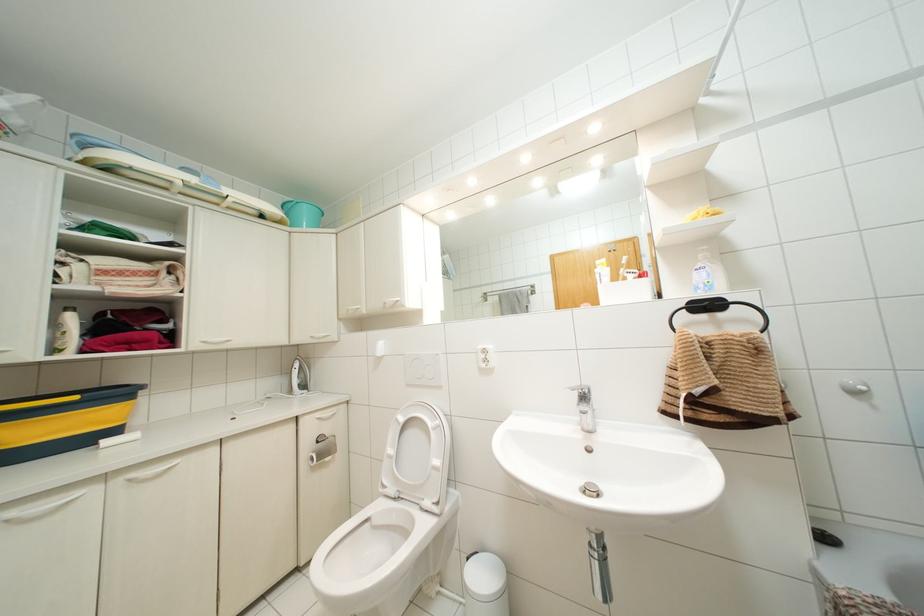
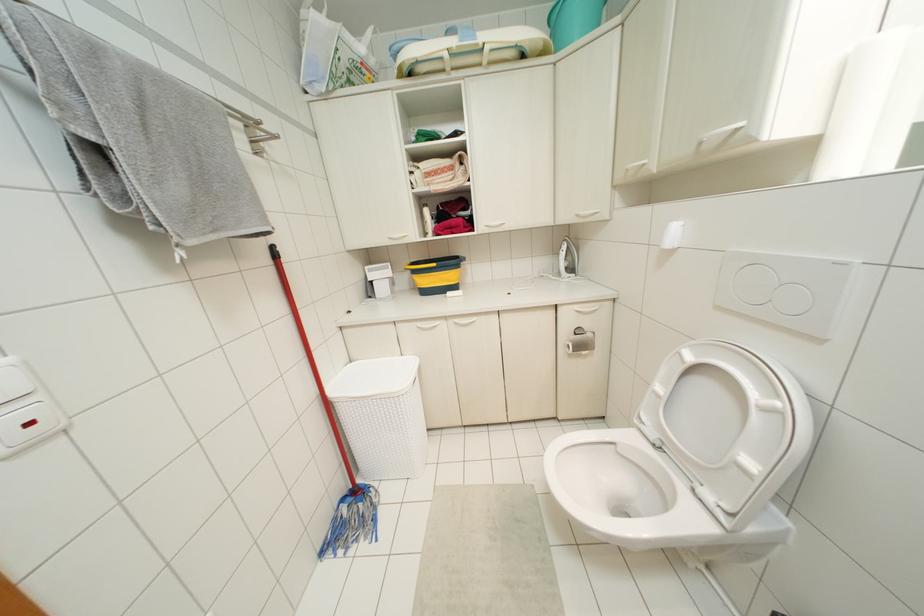
Find the pixel in the second image that matches pixel 390 450 in the first image.

(659, 387)